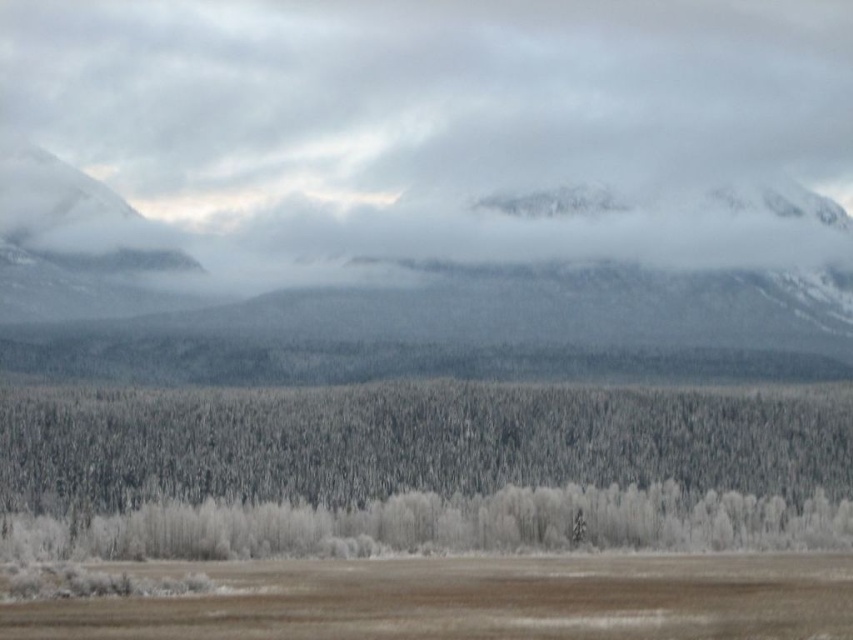
Question: Which object is farther from the camera taking this photo?

Choices:
 (A) white fluffy cloud at upper center
 (B) snow-covered trees at center

Answer: (A)

Question: Does snow-covered trees at center have a greater width compared to snowy rock mountain at upper center?

Choices:
 (A) yes
 (B) no

Answer: (B)

Question: Can you confirm if white fluffy cloud at upper center is smaller than snowy rock mountain at upper center?

Choices:
 (A) no
 (B) yes

Answer: (A)

Question: Which point is closer to the camera taking this photo?

Choices:
 (A) (705, 444)
 (B) (526, 12)
 (C) (113, 196)
 (D) (286, 637)

Answer: (D)

Question: Estimate the real-world distances between objects in this image. Which object is farther from the snow-covered trees at center?

Choices:
 (A) brown matte grassland at lower center
 (B) white fluffy cloud at upper center
 (C) snowy rock mountain at upper center

Answer: (B)

Question: Is snow-covered trees at center closer to camera compared to brown matte grassland at lower center?

Choices:
 (A) yes
 (B) no

Answer: (B)